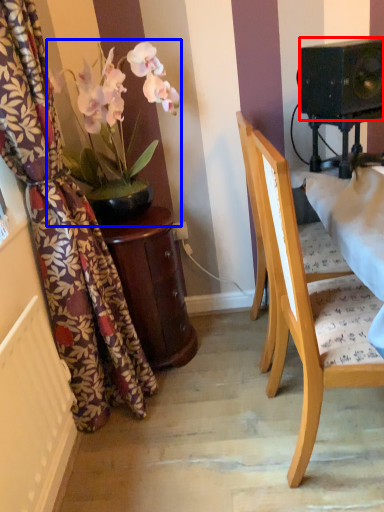
Question: Which of the following is the closest to the observer, speaker (highlighted by a red box) or houseplant (highlighted by a blue box)?

Choices:
 (A) speaker
 (B) houseplant

Answer: (A)